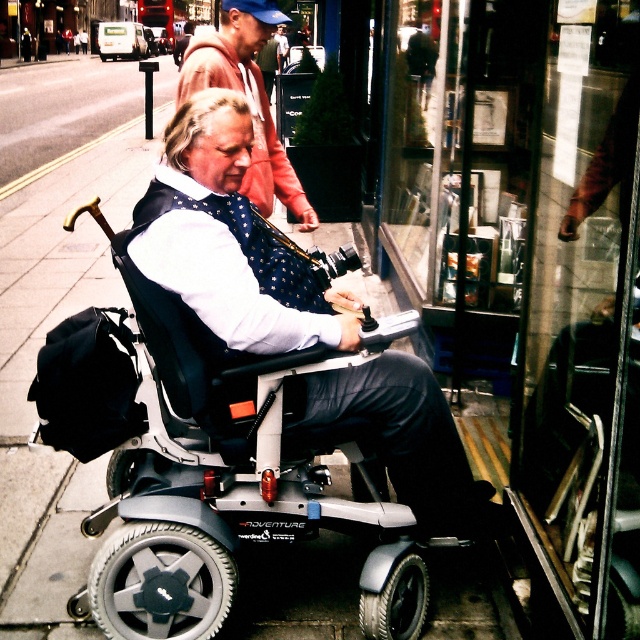
The image size is (640, 640). What do you see at coordinates (536, 256) in the screenshot?
I see `glassy reflective window at center` at bounding box center [536, 256].

Does point (420, 45) come behind point (234, 70)?

Yes.

Locate an element on the screen. This screenshot has height=640, width=640. glassy reflective window at center is located at coordinates (536, 256).

Is glassy reflective window at center shorter than matte black wheelchair at center?

Incorrect, glassy reflective window at center's height does not fall short of matte black wheelchair at center's.

Who is taller, glassy reflective window at center or matte black wheelchair at center?

Standing taller between the two is glassy reflective window at center.

Does point (445, 157) lie behind point (198, 340)?

Yes, it is.

The height and width of the screenshot is (640, 640). What are the coordinates of `glassy reflective window at center` in the screenshot? It's located at (536, 256).

Which is below, matte black wheelchair at center or polka dot bow tie at center?

matte black wheelchair at center is lower down.

Can you confirm if matte black wheelchair at center is shorter than polka dot bow tie at center?

No, matte black wheelchair at center is not shorter than polka dot bow tie at center.

The width and height of the screenshot is (640, 640). What do you see at coordinates (230, 244) in the screenshot?
I see `matte black wheelchair at center` at bounding box center [230, 244].

Where is `matte black wheelchair at center`? The image size is (640, 640). matte black wheelchair at center is located at coordinates (230, 244).